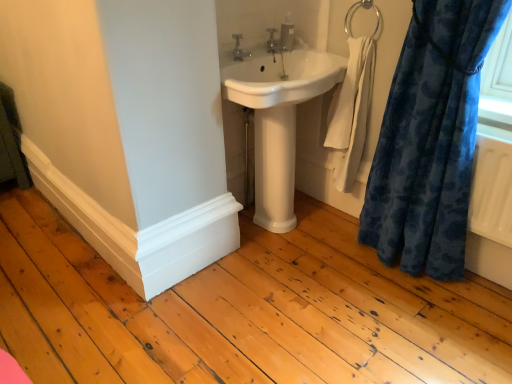
Question: In which direction should I rotate to look at satin silver soap dispenser at upper center?

Choices:
 (A) left
 (B) right

Answer: (B)

Question: Considering the relative sizes of white glossy sink at center and white glossy pedestal at center in the image provided, is white glossy sink at center bigger than white glossy pedestal at center?

Choices:
 (A) yes
 (B) no

Answer: (A)

Question: Is white glossy sink at center placed right next to white glossy pedestal at center?

Choices:
 (A) no
 (B) yes

Answer: (A)

Question: Is white glossy sink at center turned away from white glossy pedestal at center?

Choices:
 (A) yes
 (B) no

Answer: (B)

Question: From a real-world perspective, is white glossy sink at center located higher than white glossy pedestal at center?

Choices:
 (A) yes
 (B) no

Answer: (A)

Question: Considering the relative positions of white glossy sink at center and white glossy pedestal at center in the image provided, is white glossy sink at center to the left of white glossy pedestal at center from the viewer's perspective?

Choices:
 (A) no
 (B) yes

Answer: (A)

Question: Can you confirm if white glossy sink at center is smaller than white glossy pedestal at center?

Choices:
 (A) no
 (B) yes

Answer: (A)

Question: Does satin silver soap dispenser at upper center have a lesser width compared to white glossy pedestal at center?

Choices:
 (A) yes
 (B) no

Answer: (A)

Question: Considering the relative sizes of satin silver soap dispenser at upper center and white glossy pedestal at center in the image provided, is satin silver soap dispenser at upper center smaller than white glossy pedestal at center?

Choices:
 (A) yes
 (B) no

Answer: (A)

Question: Is satin silver soap dispenser at upper center not inside white glossy pedestal at center?

Choices:
 (A) yes
 (B) no

Answer: (A)

Question: From a real-world perspective, is satin silver soap dispenser at upper center positioned under white glossy pedestal at center based on gravity?

Choices:
 (A) yes
 (B) no

Answer: (B)

Question: From the image's perspective, is satin silver soap dispenser at upper center under white glossy pedestal at center?

Choices:
 (A) yes
 (B) no

Answer: (B)

Question: Would you consider satin silver soap dispenser at upper center to be distant from white glossy pedestal at center?

Choices:
 (A) no
 (B) yes

Answer: (A)

Question: Is matte silver faucet at upper center, which ranks as the 1th tap in right-to-left order, closer to the viewer compared to white glossy sink at center?

Choices:
 (A) yes
 (B) no

Answer: (B)